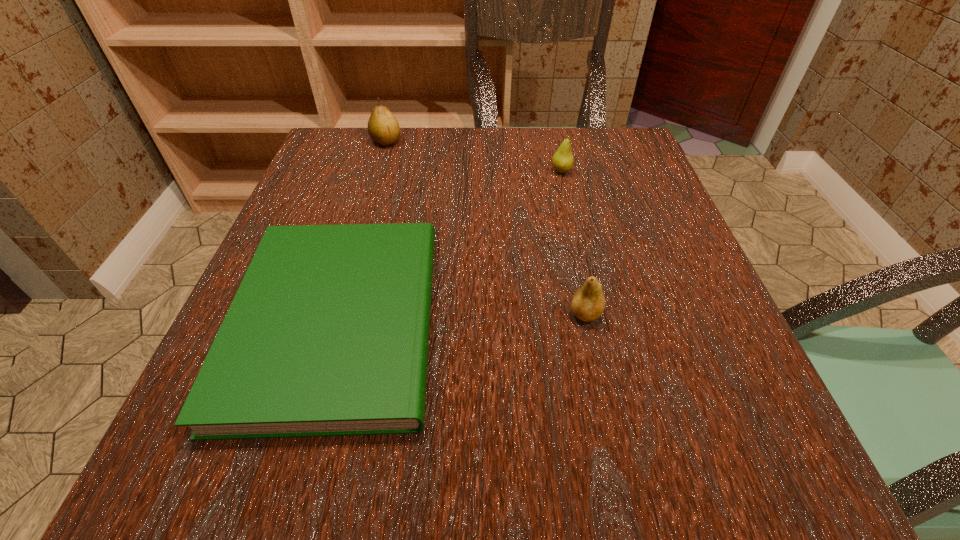
Image resolution: width=960 pixels, height=540 pixels. I want to click on vacant area between the nearest pear and the farthest pear, so click(486, 227).

This screenshot has height=540, width=960. Identify the location of vacant area between the third nearest object and the nearest pear. (573, 242).

Find the location of a particular element. free space between the farthest object and the third nearest object is located at coordinates (473, 157).

Find the location of a particular element. The image size is (960, 540). unoccupied position between the farthest pear and the third nearest object is located at coordinates coord(473,157).

Identify the location of free space between the second farthest pear and the leftmost pear. (473, 157).

You are a GUI agent. You are given a task and a screenshot of the screen. Output one action in this format:
    pyautogui.click(x=<x>, y=<y>)
    Task: Click on the vacant area between the second farthest object and the nearest pear
    
    Given the screenshot: What is the action you would take?
    pyautogui.click(x=573, y=242)

The height and width of the screenshot is (540, 960). In order to click on free spot between the farthest pear and the second farthest pear in this screenshot , I will do `click(473, 157)`.

This screenshot has width=960, height=540. I want to click on free spot between the paperback book and the nearest pear, so click(x=461, y=318).

The image size is (960, 540). What are the coordinates of `vacant space in between the farthest object and the second farthest pear` in the screenshot? It's located at (473, 157).

What are the coordinates of `object that stands as the second closest to the paperback book` in the screenshot? It's located at (562, 160).